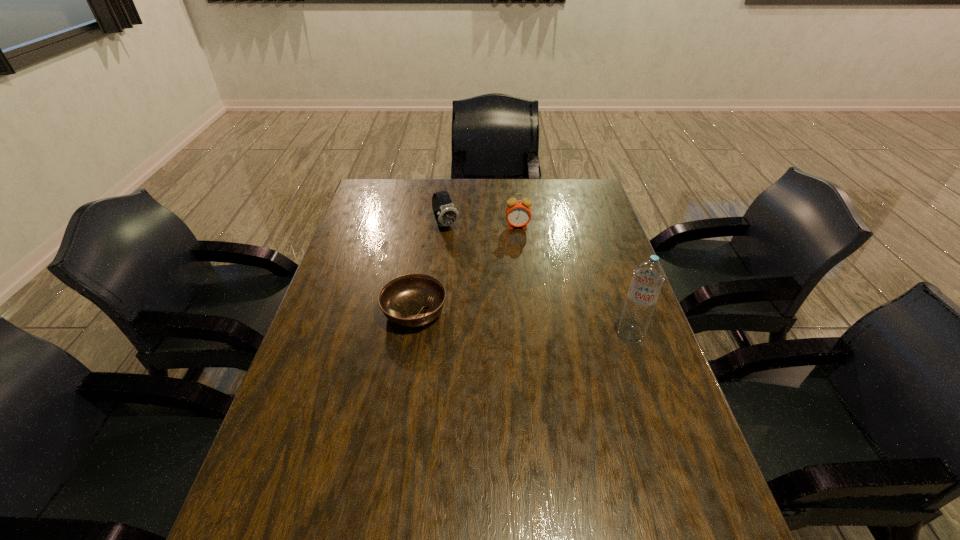
You are a GUI agent. You are given a task and a screenshot of the screen. Output one action in this format:
    pyautogui.click(x=<x>, y=<y>)
    Task: Click on the vacant spot on the desktop that is between the soup bowl and the rightmost object and is positioned on the face of the watch
    The height and width of the screenshot is (540, 960).
    Given the screenshot: What is the action you would take?
    pyautogui.click(x=514, y=322)

Locate an element on the screen. This screenshot has height=540, width=960. vacant space on the desktop that is between the shortest object and the tallest object and is positioned on the face of the alarm clock is located at coordinates (527, 323).